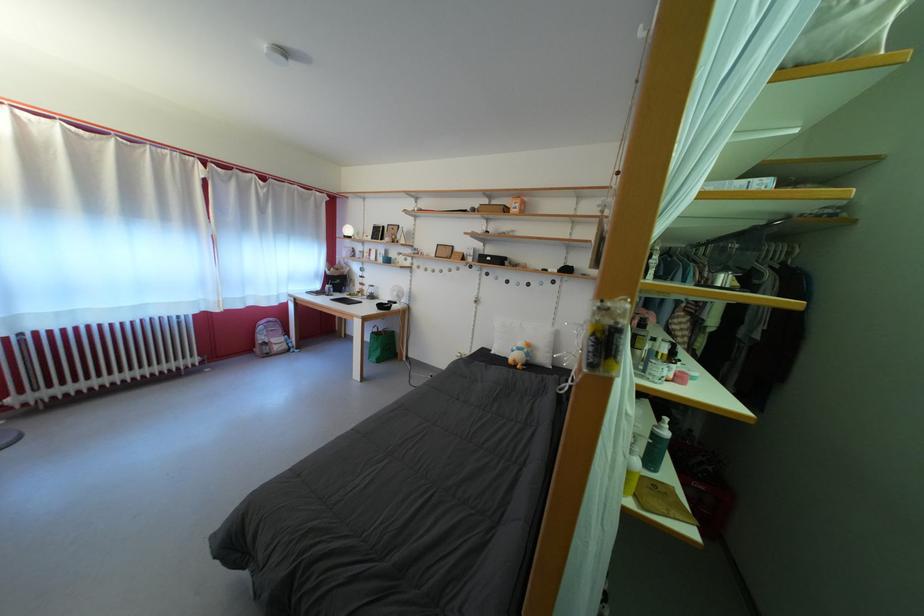
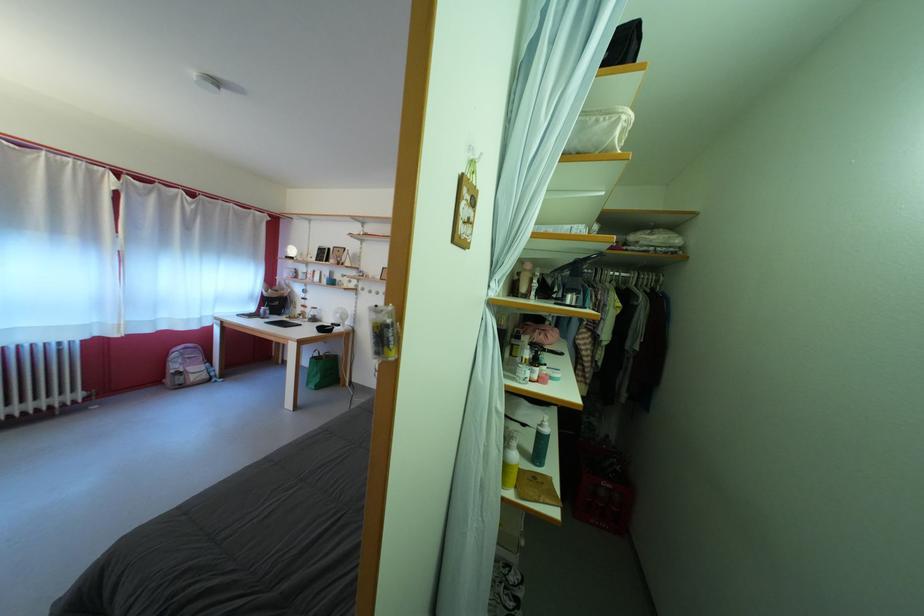
Locate, in the second image, the point that corresponds to point (381, 302) in the first image.

(322, 325)